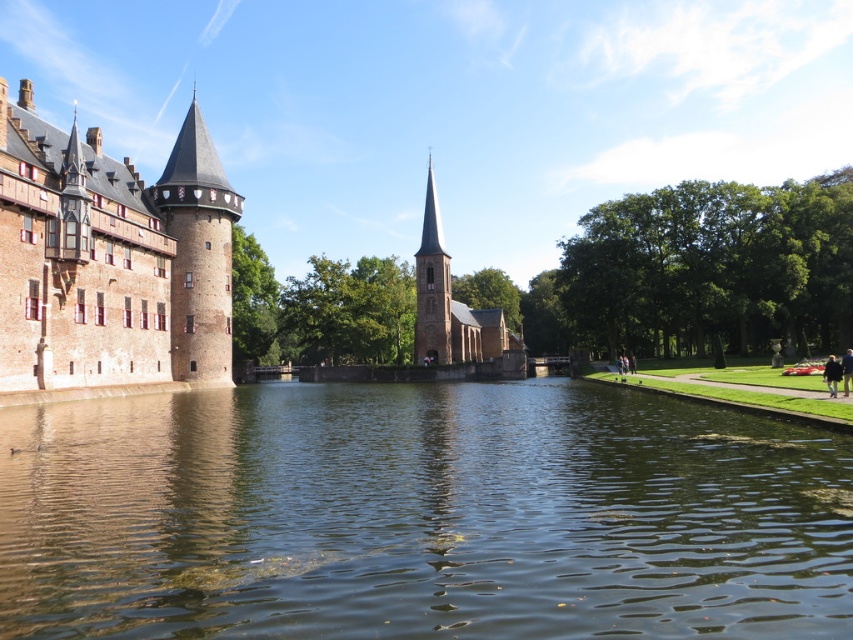
Question: Which point appears farthest from the camera in this image?

Choices:
 (A) (215, 515)
 (B) (161, 172)
 (C) (432, 358)

Answer: (C)

Question: Estimate the real-world distances between objects in this image. Which object is farther from the brown stone tower at center?

Choices:
 (A) brick tower at left
 (B) brick stonework tower at left

Answer: (A)

Question: Does greenish-brown water at center have a larger size compared to brown stone tower at center?

Choices:
 (A) yes
 (B) no

Answer: (A)

Question: Among these points, which one is farthest from the camera?

Choices:
 (A) (341, 577)
 (B) (431, 268)
 (C) (21, 96)

Answer: (B)

Question: Is brick tower at left below brick stonework tower at left?

Choices:
 (A) yes
 (B) no

Answer: (A)

Question: Is greenish-brown water at center above brick tower at left?

Choices:
 (A) yes
 (B) no

Answer: (B)